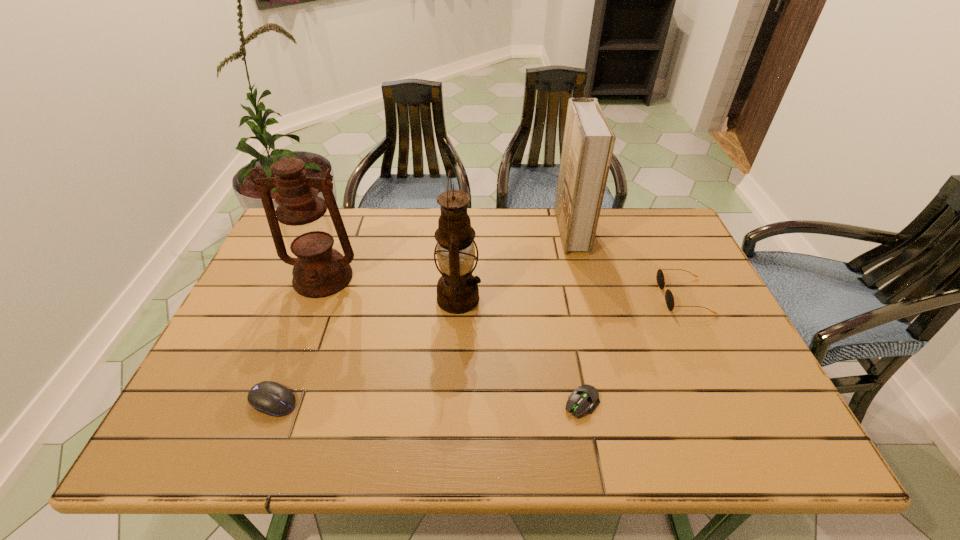
Identify the location of oil lamp that is at the left edge. point(319,271).

Image resolution: width=960 pixels, height=540 pixels. What are the coordinates of `computer mouse located at the left edge` in the screenshot? It's located at (271, 398).

Image resolution: width=960 pixels, height=540 pixels. Find the location of `object at the right edge`. object at the right edge is located at coordinates (669, 297).

This screenshot has width=960, height=540. What are the coordinates of `object located at the near left corner` in the screenshot? It's located at (271, 398).

I want to click on blank space at the far edge of the desktop, so click(x=495, y=213).

Locate an element on the screen. This screenshot has height=540, width=960. free region at the near edge is located at coordinates (461, 433).

In the image, there is a desktop. Where is `free space at the left edge`? The image size is (960, 540). free space at the left edge is located at coordinates click(x=278, y=264).

This screenshot has width=960, height=540. In order to click on vacant space at the right edge of the desktop in this screenshot , I will do `click(709, 301)`.

Identify the location of free space at the near left corner of the desktop. (213, 437).

What are the coordinates of `blank space at the near right corner of the desktop` in the screenshot? It's located at (744, 415).